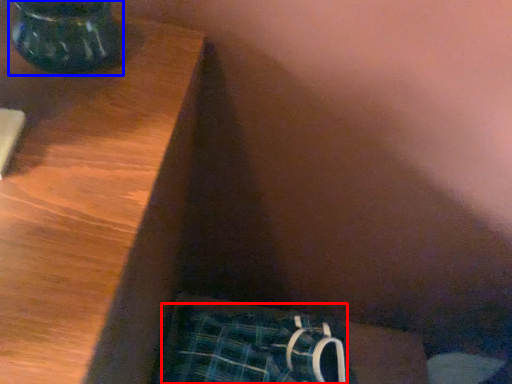
Question: Which point is further to the camera, underclothes (highlighted by a red box) or vase (highlighted by a blue box)?

Choices:
 (A) underclothes
 (B) vase

Answer: (A)